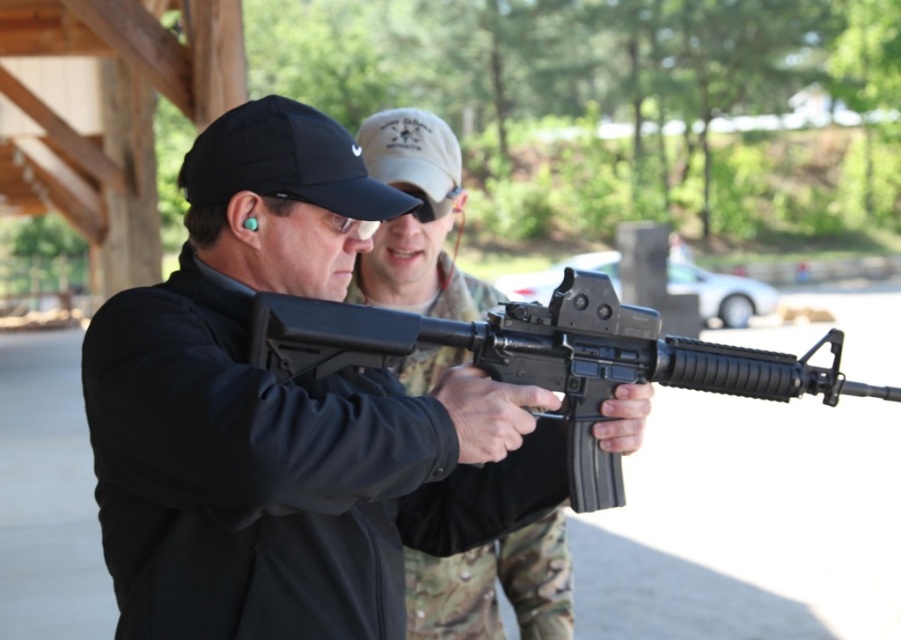
Is matte black rifle at center closer to the viewer compared to black fabric baseball cap at upper center?

No, it is not.

Between point (431, 172) and point (338, 145), which one is positioned in front?

Positioned in front is point (338, 145).

Where is `matte black rifle at center`? matte black rifle at center is located at coordinates (417, 221).

From the picture: Can you confirm if black matte rifle at center is smaller than black fabric baseball cap at upper center?

Actually, black matte rifle at center might be larger than black fabric baseball cap at upper center.

Is black matte rifle at center further to camera compared to black fabric baseball cap at upper center?

No, black matte rifle at center is closer to the viewer.

The image size is (901, 640). Find the location of `black matte rifle at center`. black matte rifle at center is located at coordinates (547, 358).

Locate an element on the screen. Image resolution: width=901 pixels, height=640 pixels. black matte rifle at center is located at coordinates (547, 358).

Can you confirm if black matte rifle at center is positioned to the right of matte black rifle at center?

Correct, you'll find black matte rifle at center to the right of matte black rifle at center.

Is black matte rifle at center thinner than matte black rifle at center?

No.

Is point (610, 371) closer to camera compared to point (448, 573)?

Yes, point (610, 371) is in front of point (448, 573).

I want to click on black matte rifle at center, so click(x=547, y=358).